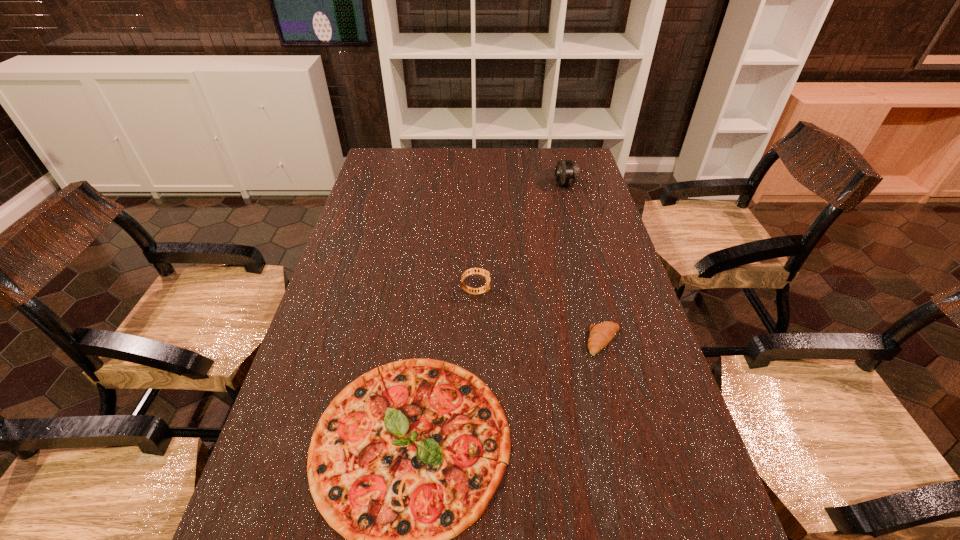
I want to click on the farthest object, so click(x=567, y=172).

Find the location of a particular element. The image size is (960, 540). the tallest object is located at coordinates (567, 172).

Where is `the third nearest object`? the third nearest object is located at coordinates (472, 271).

The image size is (960, 540). What are the coordinates of `the second tallest object` in the screenshot? It's located at (472, 271).

Locate an element on the screen. This screenshot has width=960, height=540. the second nearest object is located at coordinates (601, 334).

Identify the location of crescent roll. pyautogui.click(x=601, y=334).

I want to click on free space located 0.250m on the front-facing side of the tallest object, so click(490, 185).

Where is `free space located 0.080m on the front-facing side of the tallest object`? free space located 0.080m on the front-facing side of the tallest object is located at coordinates (534, 185).

The height and width of the screenshot is (540, 960). Identify the location of free location located 0.070m on the front-facing side of the tallest object. (537, 185).

Locate an element on the screen. Image resolution: width=960 pixels, height=540 pixels. vacant space located 0.070m on the face of the second farthest object is located at coordinates click(x=515, y=292).